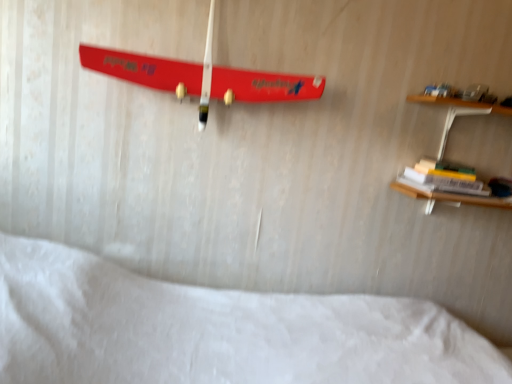
Question: Is hardcover book at right to the left or to the right of shiny red skateboard at upper center in the image?

Choices:
 (A) left
 (B) right

Answer: (B)

Question: Based on their sizes in the image, would you say hardcover book at right is bigger or smaller than shiny red skateboard at upper center?

Choices:
 (A) big
 (B) small

Answer: (B)

Question: Based on their relative distances, which object is farther from the shiny red skateboard at upper center?

Choices:
 (A) hardcover book at right
 (B) white soft bed at lower center

Answer: (A)

Question: Which object is the farthest from the hardcover book at right?

Choices:
 (A) white soft bed at lower center
 (B) shiny red skateboard at upper center

Answer: (A)